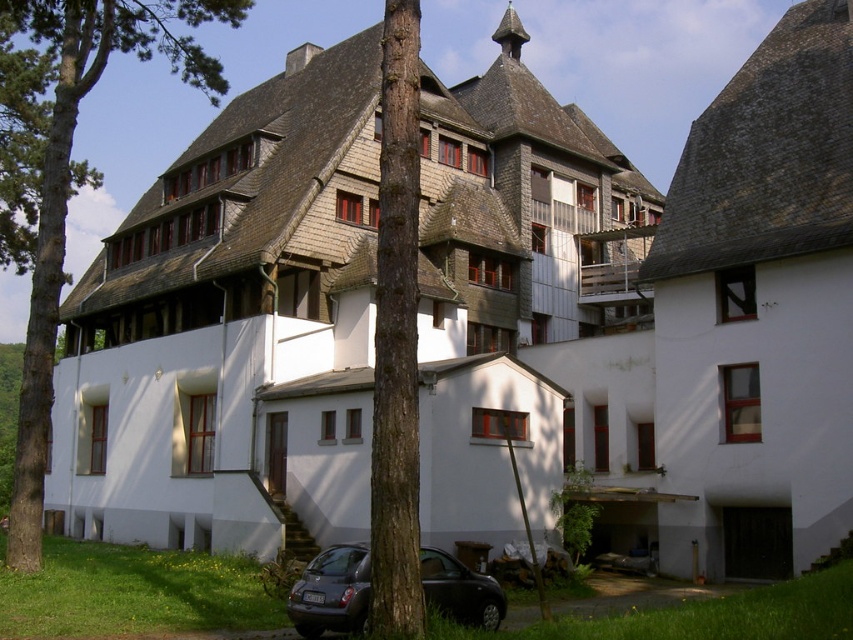
You are a photographer trying to capture the entire building in a single shot. You notice the brown rough bark tree at center and the metallic gray hatchback at lower center are blocking your view. Which object should you move to get a clearer view of the building?

The brown rough bark tree at center is bigger than the metallic gray hatchback at lower center, so you should move the brown rough bark tree at center first to get a clearer view of the building.

You are standing in front of a building and see the green bark tree at left and the brown rough bark tree at center. Which tree is closer to you?

The green bark tree at left is closer to you because it is positioned further to the viewer than the brown rough bark tree at center.

You are standing in front of the building and want to take a photo of the metallic gray hatchback at lower center without the green bark tree at left blocking it. Which direction should you move to ensure the tree is out of frame?

Move to the right side of the scene to avoid the green bark tree at left blocking the view of the metallic gray hatchback at lower center.